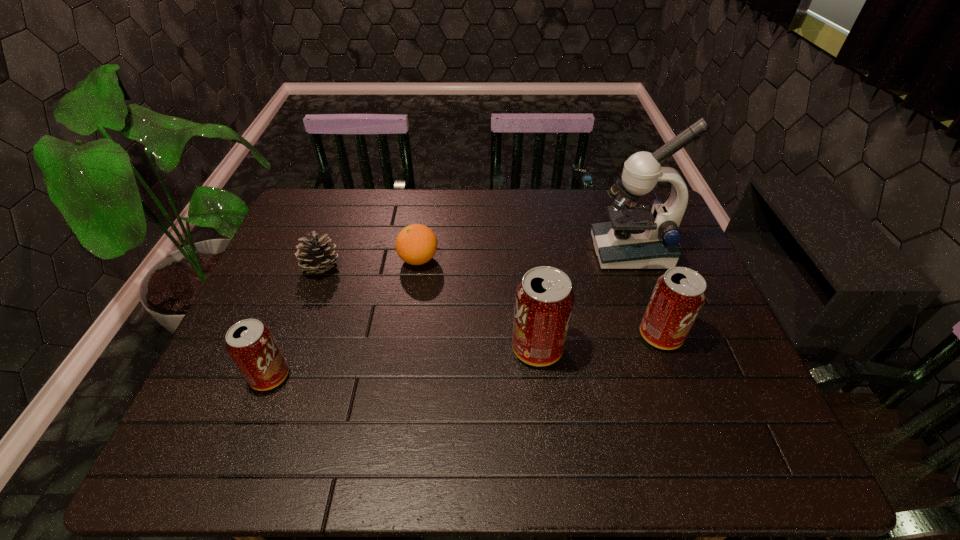
Locate an element on the screen. blank area located on the left of the rightmost soda can is located at coordinates (540, 335).

This screenshot has height=540, width=960. I want to click on free space located at the eyepiece of the microscope, so click(x=578, y=251).

The height and width of the screenshot is (540, 960). In order to click on vacant point located 0.290m at the eyepiece of the microscope in this screenshot , I will do `click(498, 251)`.

This screenshot has height=540, width=960. In order to click on free spot located at the eyepiece of the microscope in this screenshot , I will do `click(481, 251)`.

You are a GUI agent. You are given a task and a screenshot of the screen. Output one action in this format:
    pyautogui.click(x=<x>, y=<y>)
    Task: Click on the vacant position located 0.400m on the right of the pinecone
    
    Given the screenshot: What is the action you would take?
    pyautogui.click(x=480, y=268)

Identify the location of free space located on the front of the orange. Image resolution: width=960 pixels, height=540 pixels. (406, 345).

The image size is (960, 540). Find the location of `object located in the far edge section of the desktop`. object located in the far edge section of the desktop is located at coordinates (638, 237).

At what (x,y) coordinates should I click in order to perform the action: click on object positioned at the near edge. Please return your answer as a coordinate pair (x, y). Image resolution: width=960 pixels, height=540 pixels. Looking at the image, I should click on (250, 343).

At what (x,y) coordinates should I click in order to perform the action: click on soda can present at the left edge. Please return your answer as a coordinate pair (x, y). This screenshot has height=540, width=960. Looking at the image, I should click on (250, 343).

The width and height of the screenshot is (960, 540). I want to click on pinecone that is at the left edge, so click(315, 256).